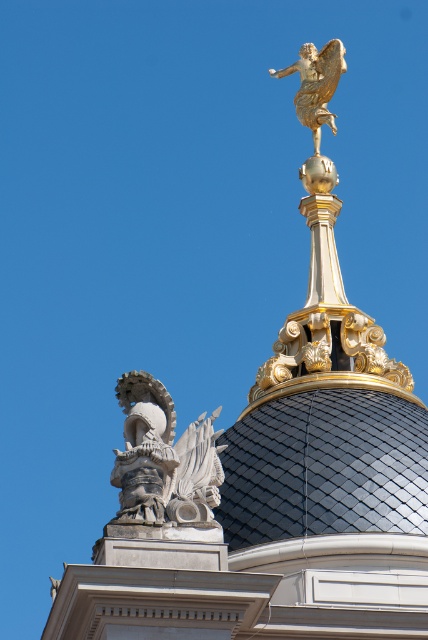
Does white stone eagle at lower left appear under gold metallic angel at upper center?

Yes.

Who is more forward, (163, 417) or (320, 138)?

Point (163, 417) is more forward.

The height and width of the screenshot is (640, 428). I want to click on white stone eagle at lower left, so click(x=163, y=460).